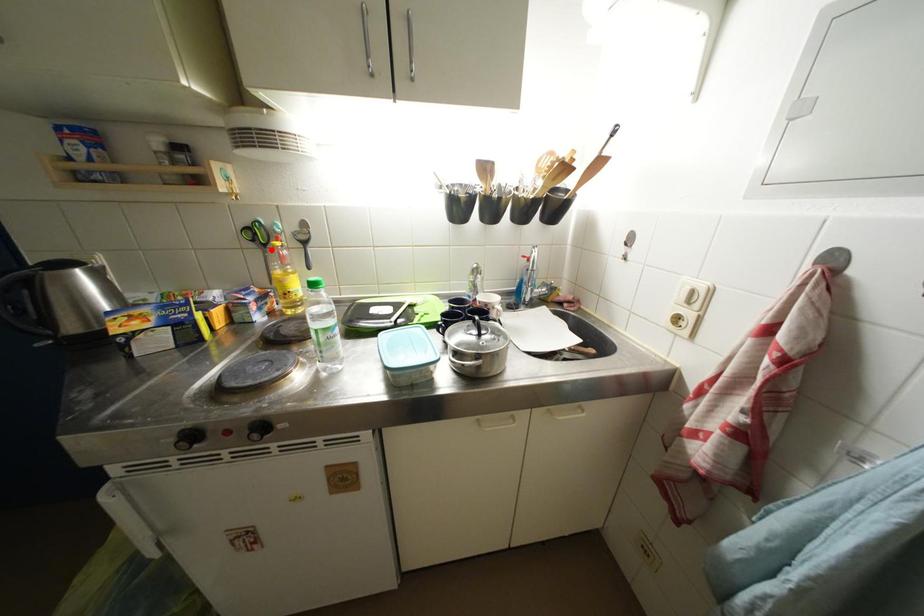
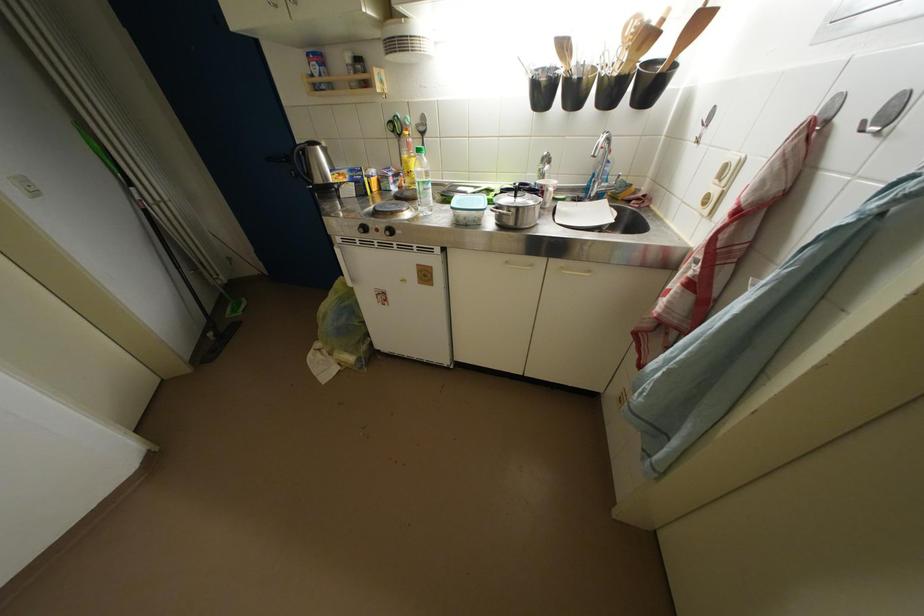
The point at the highlighted location is marked in the first image. Where is the corresponding point in the second image?

(407, 140)